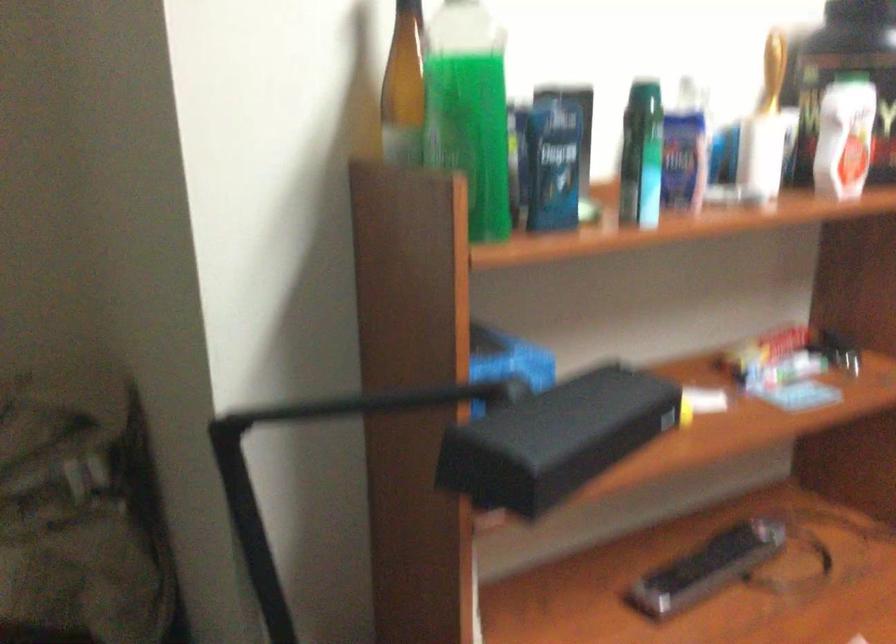
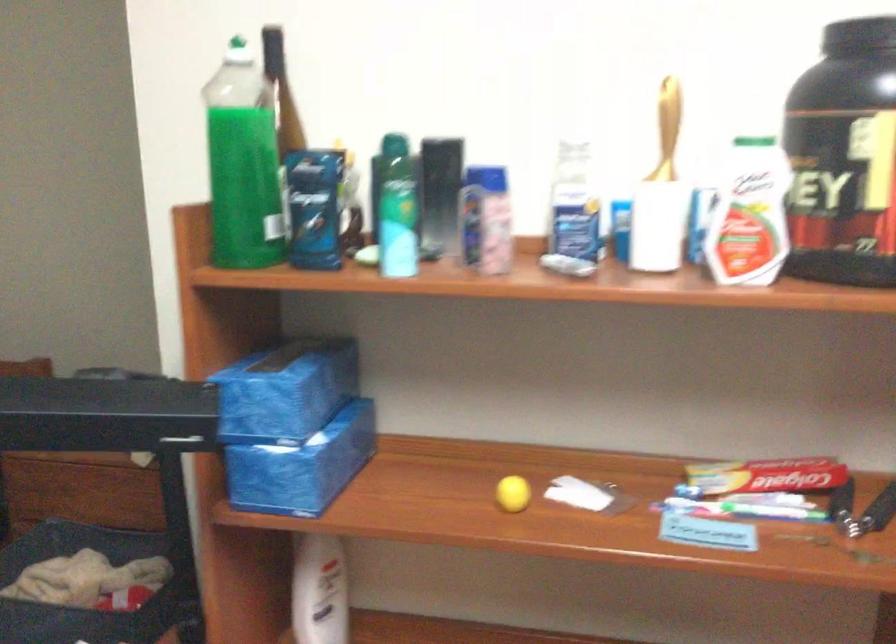
In the second image, find the point that corresponds to the point at 780,373 in the first image.

(743, 509)